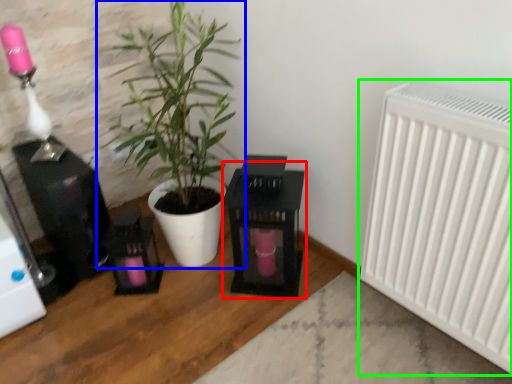
Question: Which object is positioned closest to table (highlighted by a red box)? Select from houseplant (highlighted by a blue box) and radiator (highlighted by a green box).

Choices:
 (A) houseplant
 (B) radiator

Answer: (A)